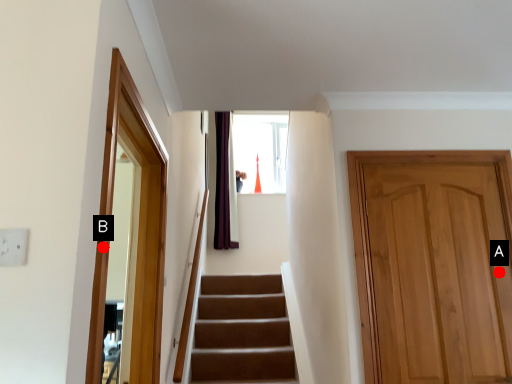
Question: Two points are circled on the image, labeled by A and B beside each circle. Which point is closer to the camera taking this photo?

Choices:
 (A) A is closer
 (B) B is closer

Answer: (B)